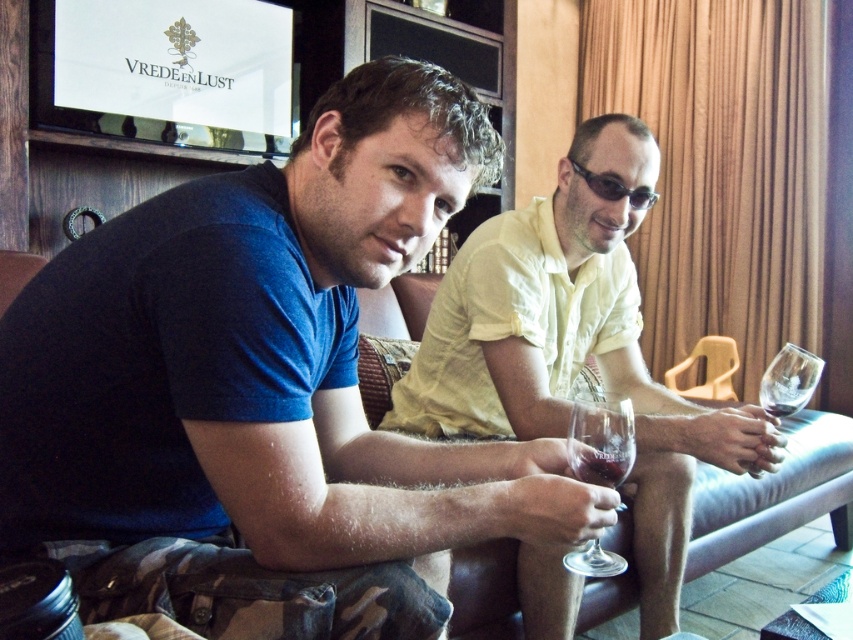
Question: Is transparent glass wine at lower center wider than dark red glass at right?

Choices:
 (A) no
 (B) yes

Answer: (B)

Question: Which point is closer to the camera?

Choices:
 (A) matte yellow shirt at center
 (B) transparent glass at right
 (C) translucent glass wine at lower center
 (D) sunglasses at center

Answer: (C)

Question: Which of the following is the farthest from the observer?

Choices:
 (A) (761, 392)
 (B) (601, 568)

Answer: (A)

Question: Can you confirm if transparent glass wine at lower center is positioned below transparent glass at right?

Choices:
 (A) no
 (B) yes

Answer: (B)

Question: Which of the following is the farthest from the observer?

Choices:
 (A) (769, 403)
 (B) (619, 474)

Answer: (A)

Question: Can you confirm if transparent glass wine at lower center is smaller than dark red glass at right?

Choices:
 (A) no
 (B) yes

Answer: (A)